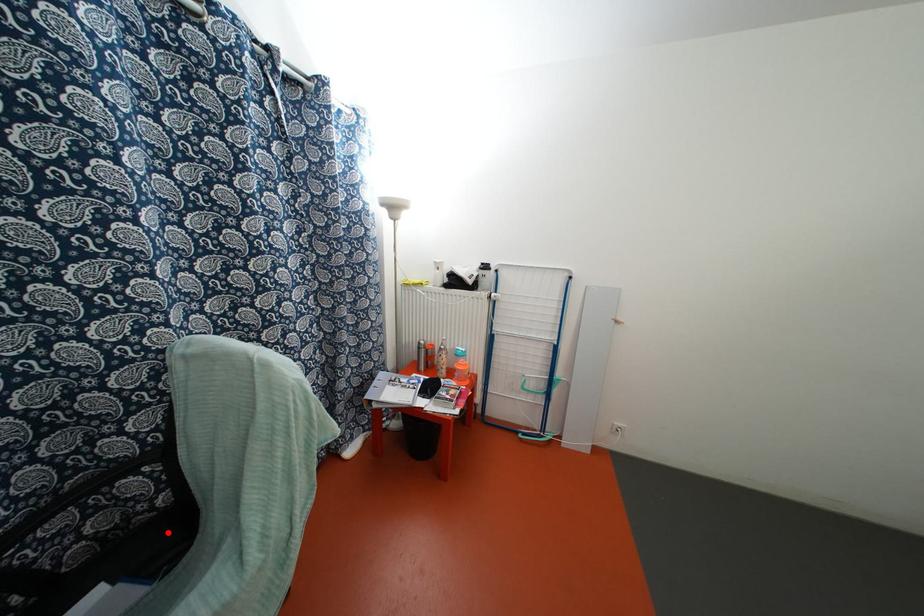
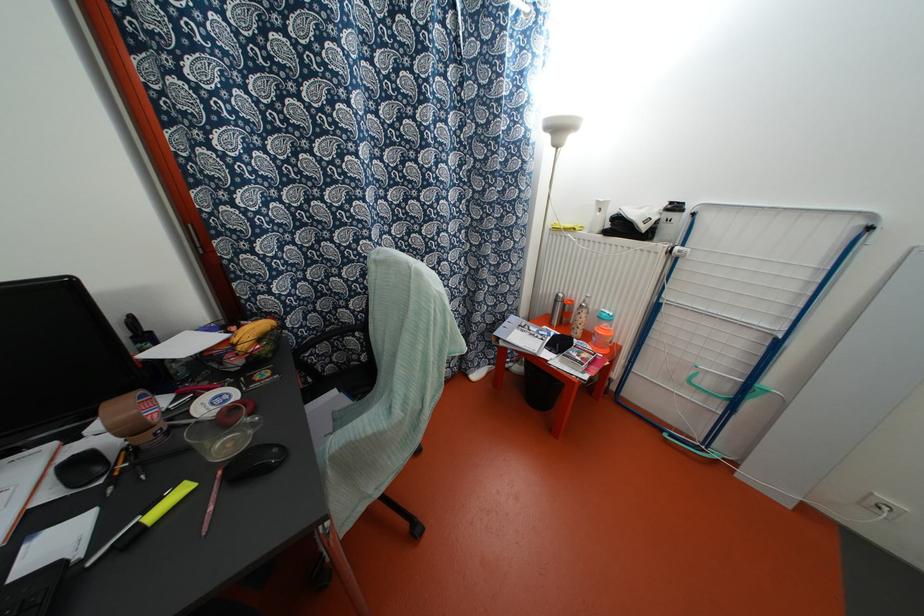
Question: I am providing you with two images of the same scene from different viewpoints. In image1, a red point is highlighted. Considering the same 3D point in image2, which of the following is correct?

Choices:
 (A) It is closer
 (B) It is farther

Answer: (B)